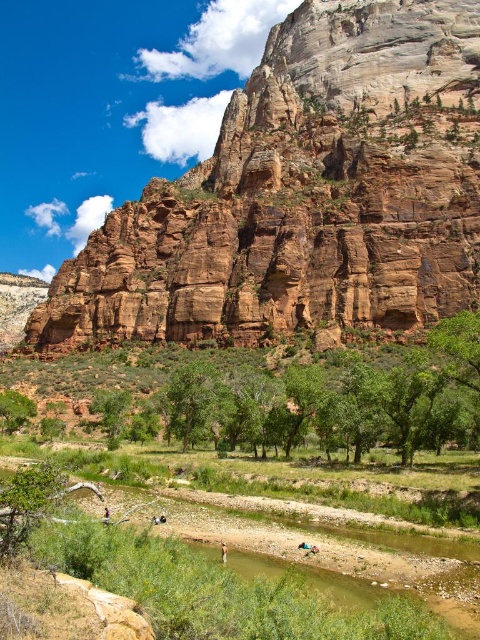
Is point (290, 605) positioned in front of point (224, 545)?

Yes, point (290, 605) is in front of point (224, 545).

Which of these two, green grassy river at center or light brown leather jacket at lower center, stands shorter?

light brown leather jacket at lower center is shorter.

Is point (335, 608) closer to viewer compared to point (225, 545)?

Yes, point (335, 608) is in front of point (225, 545).

Locate an element on the screen. The width and height of the screenshot is (480, 640). green grassy river at center is located at coordinates (177, 595).

Is the position of green grassy river at center more distant than that of smooth skin person at center?

No, green grassy river at center is closer to the viewer.

Is green grassy river at center closer to camera compared to smooth skin person at center?

Yes, green grassy river at center is in front of smooth skin person at center.

Describe the element at coordinates (177, 595) in the screenshot. I see `green grassy river at center` at that location.

Find the location of `green grassy river at center`. green grassy river at center is located at coordinates (177, 595).

Who is lower down, rustic rock cliff at upper center or smooth skin person at center?

Positioned lower is smooth skin person at center.

Can you confirm if rustic rock cliff at upper center is wider than smooth skin person at center?

Correct, the width of rustic rock cliff at upper center exceeds that of smooth skin person at center.

Is point (323, 220) farther from viewer compared to point (107, 515)?

Yes, it is.

At what (x,y) coordinates should I click in order to perform the action: click on rustic rock cliff at upper center. Please return your answer as a coordinate pair (x, y). The height and width of the screenshot is (640, 480). Looking at the image, I should click on (303, 195).